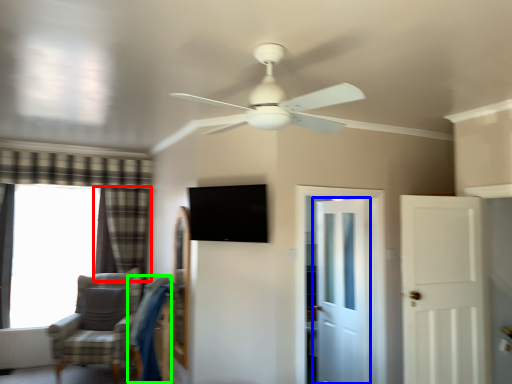
Question: Which is nearer to the curtain (highlighted by a red box)? door (highlighted by a blue box) or swivel chair (highlighted by a green box).

Choices:
 (A) door
 (B) swivel chair

Answer: (B)